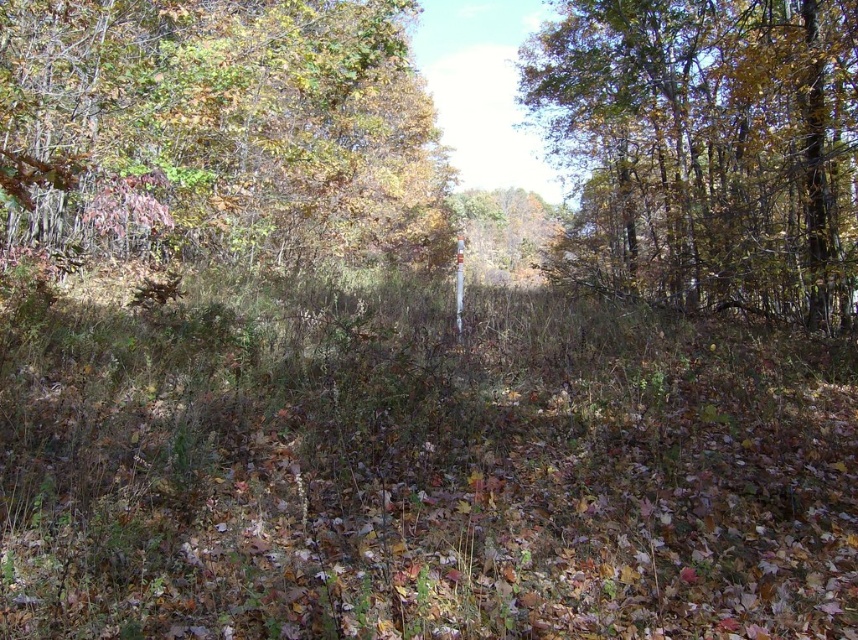
Question: Is green leafy tree at upper left above green leafy tree at upper right?

Choices:
 (A) yes
 (B) no

Answer: (B)

Question: Considering the relative positions of green leafy tree at upper left and green leafy tree at upper right in the image provided, where is green leafy tree at upper left located with respect to green leafy tree at upper right?

Choices:
 (A) left
 (B) right

Answer: (A)

Question: Which of the following is the closest to the observer?

Choices:
 (A) (101, 22)
 (B) (789, 224)

Answer: (A)

Question: From the image, what is the correct spatial relationship of green leafy tree at upper left in relation to green leafy tree at upper right?

Choices:
 (A) above
 (B) below

Answer: (B)

Question: Which of the following is the closest to the observer?

Choices:
 (A) green leafy tree at upper left
 (B) green leafy tree at upper right

Answer: (A)